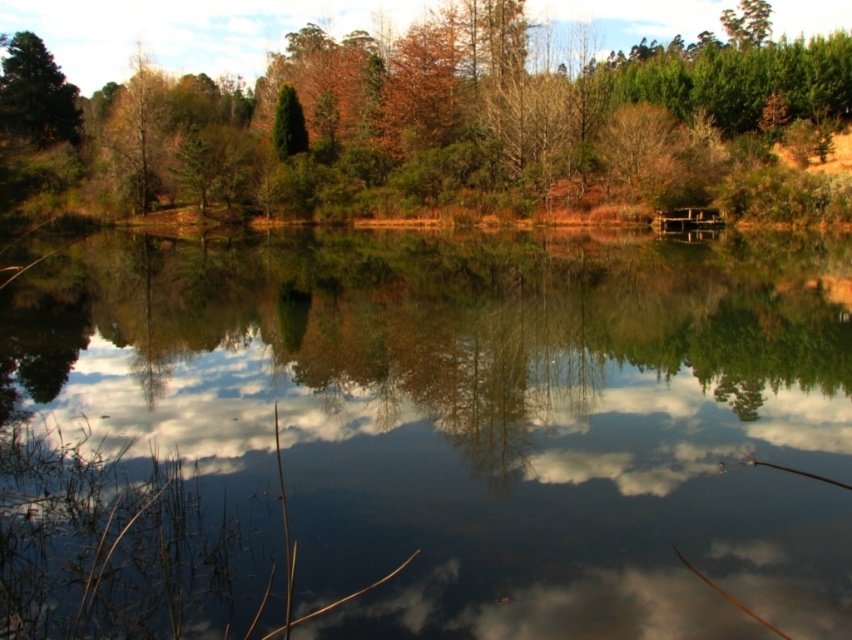
You are an artist planning to paint the scene. You want to ensure the green matte tree at center and the green matte tree at upper left are proportionally accurate. Which tree should you draw larger in your painting?

The green matte tree at center should be drawn larger in the painting since it has a larger size compared to the green matte tree at upper left according to the description.

You are an environmental scientist assessing the scene. You need to determine which object occupies a larger horizontal space in the image between the transparent water at center and the green matte tree at upper left. Which one is wider?

The transparent water at center is wider than the green matte tree at upper left because its width surpasses the tree.